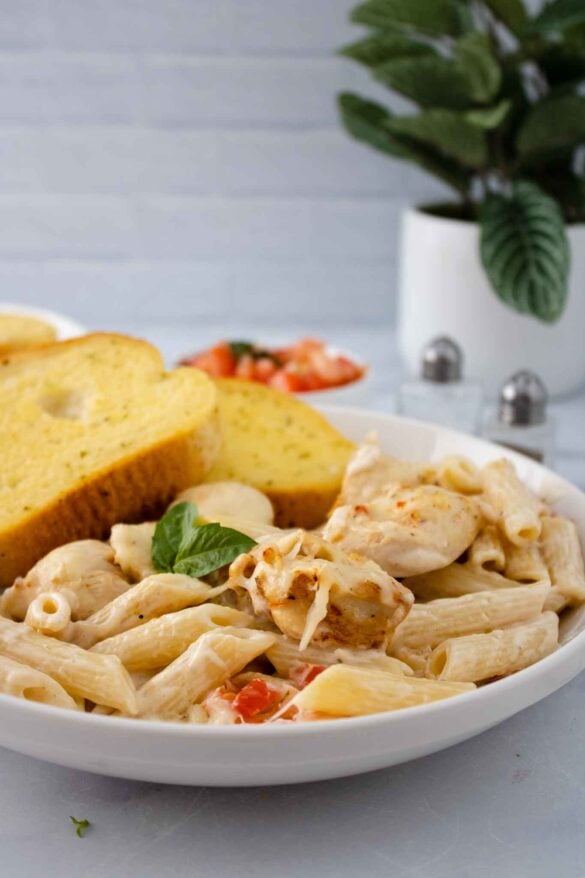
You are a GUI agent. You are given a task and a screenshot of the screen. Output one action in this format:
    pyautogui.click(x=<x>, y=<y>)
    Task: Click on the table
    
    Given the screenshot: What is the action you would take?
    pyautogui.click(x=116, y=822)